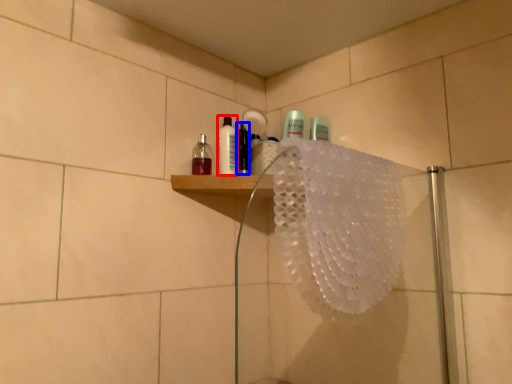
Question: Which of the following is the closest to the observer, mouthwash (highlighted by a red box) or mouthwash (highlighted by a blue box)?

Choices:
 (A) mouthwash
 (B) mouthwash

Answer: (B)